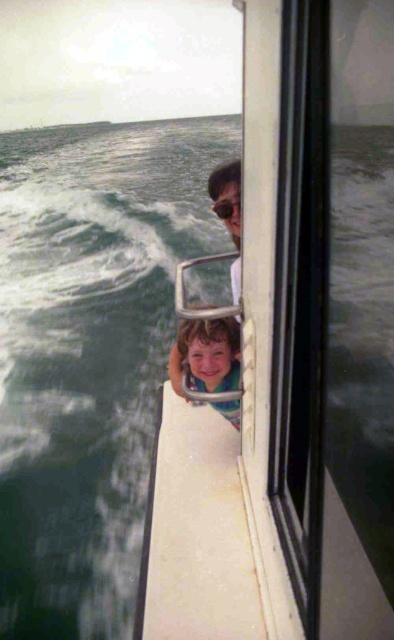
Question: Which of the following is the farthest from the observer?

Choices:
 (A) (169, 358)
 (B) (226, 196)

Answer: (A)

Question: Which point appears closest to the camera in this image?

Choices:
 (A) (193, 349)
 (B) (213, 209)

Answer: (A)

Question: Which point appears closest to the camera in this image?

Choices:
 (A) (211, 324)
 (B) (237, 196)

Answer: (A)

Question: Is smooth skin face at center positioned behind clear plastic goggles at upper center?

Choices:
 (A) yes
 (B) no

Answer: (B)

Question: Can you confirm if smooth skin face at center is bigger than clear plastic goggles at upper center?

Choices:
 (A) no
 (B) yes

Answer: (B)

Question: Is smooth skin face at center positioned behind clear plastic goggles at upper center?

Choices:
 (A) yes
 (B) no

Answer: (B)